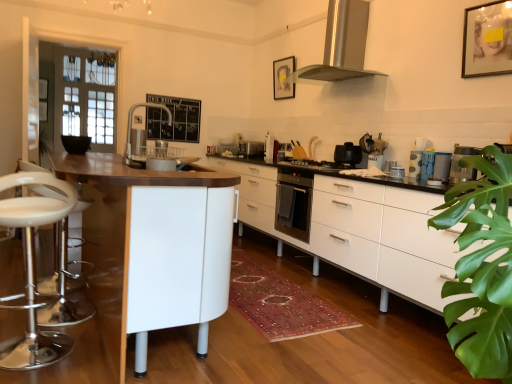
The width and height of the screenshot is (512, 384). What are the coordinates of `vacant point to the right of white metallic swivel chair at left` in the screenshot? It's located at (99, 346).